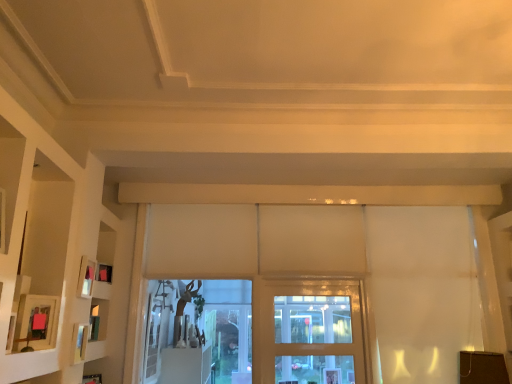
What do you see at coordinates (104, 273) in the screenshot? This screenshot has height=384, width=512. I see `matte black picture frame at left, the 1th picture frame when ordered from back to front` at bounding box center [104, 273].

This screenshot has width=512, height=384. Find the location of `matte pink picture frame at left, acting as the 3th picture frame starting from the back`. matte pink picture frame at left, acting as the 3th picture frame starting from the back is located at coordinates (36, 323).

The width and height of the screenshot is (512, 384). I want to click on clear glass door at center, so click(x=307, y=331).

From a real-world perspective, between clear glass door at center and white matte shelf at left, who is vertically higher?

In real-world perspective, white matte shelf at left is above.

Does clear glass door at center turn towards white matte shelf at left?

No, clear glass door at center is not oriented towards white matte shelf at left.

Which is more to the left, clear glass door at center or white matte shelf at left?

From the viewer's perspective, white matte shelf at left appears more on the left side.

From the image's perspective, which is above, clear glass door at center or white matte shelf at left?

white matte shelf at left appears higher in the image.

Is matte black picture frame at left, arranged as the third picture frame when viewed from the front, smaller than matte pink picture frame at left, the first picture frame positioned from the front?

Yes.

Considering the sizes of objects matte black picture frame at left, the 1th picture frame when ordered from back to front, and matte pink picture frame at left, the first picture frame positioned from the front, in the image provided, who is shorter, matte black picture frame at left, the 1th picture frame when ordered from back to front, or matte pink picture frame at left, the first picture frame positioned from the front,?

matte black picture frame at left, the 1th picture frame when ordered from back to front, is shorter.

In the image, is matte black picture frame at left, the 1th picture frame when ordered from back to front, positioned in front of or behind matte pink picture frame at left, the first picture frame positioned from the front?

Clearly, matte black picture frame at left, the 1th picture frame when ordered from back to front, is behind matte pink picture frame at left, the first picture frame positioned from the front.

Can you confirm if matte black picture frame at left, the 1th picture frame when ordered from back to front, is thinner than matte pink picture frame at left, acting as the 3th picture frame starting from the back?

Yes, matte black picture frame at left, the 1th picture frame when ordered from back to front, is thinner than matte pink picture frame at left, acting as the 3th picture frame starting from the back.

Who is bigger, matte wooden picture frame at left, the second picture frame from the back, or matte pink picture frame at left, the first picture frame positioned from the front?

matte pink picture frame at left, the first picture frame positioned from the front, is bigger.

Based on their positions, is matte wooden picture frame at left, the second picture frame from the back, located to the left or right of matte pink picture frame at left, the first picture frame positioned from the front?

In the image, matte wooden picture frame at left, the second picture frame from the back, appears on the right side of matte pink picture frame at left, the first picture frame positioned from the front.

Could matte pink picture frame at left, the first picture frame positioned from the front, be considered to be inside matte wooden picture frame at left, the second picture frame from the back?

That's incorrect, matte pink picture frame at left, the first picture frame positioned from the front, is not inside matte wooden picture frame at left, the second picture frame from the back.

Considering the relative sizes of white matte shelf at left and matte pink picture frame at left, acting as the 3th picture frame starting from the back, in the image provided, is white matte shelf at left shorter than matte pink picture frame at left, acting as the 3th picture frame starting from the back,?

No.

Is white matte shelf at left positioned with its back to matte pink picture frame at left, acting as the 3th picture frame starting from the back?

Yes, matte pink picture frame at left, acting as the 3th picture frame starting from the back, is at the back of white matte shelf at left.

Which is less distant, (35, 250) or (21, 326)?

Point (35, 250) is farther from the camera than point (21, 326).

Can you see white matte shelf at left touching matte pink picture frame at left, acting as the 3th picture frame starting from the back?

No, white matte shelf at left is not touching matte pink picture frame at left, acting as the 3th picture frame starting from the back.

Looking at the image, does matte pink picture frame at left, acting as the 3th picture frame starting from the back, seem bigger or smaller compared to white matte shelf at left?

matte pink picture frame at left, acting as the 3th picture frame starting from the back, is smaller than white matte shelf at left.

Could you measure the distance between matte pink picture frame at left, acting as the 3th picture frame starting from the back, and white matte shelf at left?

11.97 inches.

Does matte pink picture frame at left, the first picture frame positioned from the front, have a lesser height compared to white matte shelf at left?

Yes, matte pink picture frame at left, the first picture frame positioned from the front, is shorter than white matte shelf at left.

Identify the location of picture frame that is the 1st one when counting backward from the white matte shelf at left. The width and height of the screenshot is (512, 384). (36, 323).

Is matte wooden picture frame at left, the second picture frame from the back, closer to the viewer compared to white matte shelf at left?

No, matte wooden picture frame at left, the second picture frame from the back, is further to the viewer.

How far apart are matte wooden picture frame at left, the 2th picture frame from the front, and white matte shelf at left?

The distance of matte wooden picture frame at left, the 2th picture frame from the front, from white matte shelf at left is 20.56 inches.

From a real-world perspective, is matte wooden picture frame at left, the 2th picture frame from the front, located beneath white matte shelf at left?

Yes, from a real-world perspective, matte wooden picture frame at left, the 2th picture frame from the front, is below white matte shelf at left.

Is white matte shelf at left located within matte wooden picture frame at left, the 2th picture frame from the front?

No.

Can you tell me how much matte black picture frame at left, arranged as the third picture frame when viewed from the front, and matte wooden picture frame at left, the second picture frame from the back, differ in facing direction?

10.9 degrees.

Looking at this image, is matte black picture frame at left, arranged as the third picture frame when viewed from the front, positioned far away from matte wooden picture frame at left, the 2th picture frame from the front?

No.

Considering the sizes of matte black picture frame at left, the 1th picture frame when ordered from back to front, and matte wooden picture frame at left, the second picture frame from the back, in the image, is matte black picture frame at left, the 1th picture frame when ordered from back to front, taller or shorter than matte wooden picture frame at left, the second picture frame from the back,?

In the image, matte black picture frame at left, the 1th picture frame when ordered from back to front, appears to be shorter than matte wooden picture frame at left, the second picture frame from the back.

This screenshot has height=384, width=512. I want to click on shelf on the left of clear glass door at center, so click(x=35, y=226).

From the matte black picture frame at left, arranged as the third picture frame when viewed from the front, count 1st picture frame to the right and point to it. Please provide its 2D coordinates.

[(36, 323)]

Looking at the image, which one is located further to matte black picture frame at left, arranged as the third picture frame when viewed from the front, clear glass door at center or matte wooden picture frame at left, the 2th picture frame from the front?

clear glass door at center.

Which object lies further to the anchor point matte black picture frame at left, the 1th picture frame when ordered from back to front, white matte shelf at left or matte wooden picture frame at left, the second picture frame from the back?

white matte shelf at left.

Estimate the real-world distances between objects in this image. Which object is further from matte pink picture frame at left, acting as the 3th picture frame starting from the back, matte wooden picture frame at left, the 2th picture frame from the front, or clear glass door at center?

clear glass door at center.

Consider the image. Considering their positions, is matte wooden picture frame at left, the second picture frame from the back, positioned further to matte pink picture frame at left, acting as the 3th picture frame starting from the back, than matte black picture frame at left, arranged as the third picture frame when viewed from the front?

The object further to matte pink picture frame at left, acting as the 3th picture frame starting from the back, is matte black picture frame at left, arranged as the third picture frame when viewed from the front.

Looking at the image, which one is located further to matte wooden picture frame at left, the second picture frame from the back, white matte shelf at left or matte black picture frame at left, the 1th picture frame when ordered from back to front?

white matte shelf at left lies further to matte wooden picture frame at left, the second picture frame from the back, than the other object.

When comparing their distances from matte pink picture frame at left, acting as the 3th picture frame starting from the back, does matte black picture frame at left, the 1th picture frame when ordered from back to front, or matte wooden picture frame at left, the 2th picture frame from the front, seem further?

matte black picture frame at left, the 1th picture frame when ordered from back to front, is positioned further to the anchor matte pink picture frame at left, acting as the 3th picture frame starting from the back.

Estimate the real-world distances between objects in this image. Which object is further from matte pink picture frame at left, acting as the 3th picture frame starting from the back, white matte shelf at left or clear glass door at center?

The object further to matte pink picture frame at left, acting as the 3th picture frame starting from the back, is clear glass door at center.

When comparing their distances from white matte shelf at left, does clear glass door at center or matte wooden picture frame at left, the 2th picture frame from the front, seem closer?

Based on the image, matte wooden picture frame at left, the 2th picture frame from the front, appears to be nearer to white matte shelf at left.

In order to click on picture frame between white matte shelf at left and matte wooden picture frame at left, the second picture frame from the back, in the front-back direction in this screenshot , I will do `click(36, 323)`.

Where is `picture frame between matte pink picture frame at left, acting as the 3th picture frame starting from the back, and matte black picture frame at left, the 1th picture frame when ordered from back to front, along the z-axis`? Image resolution: width=512 pixels, height=384 pixels. picture frame between matte pink picture frame at left, acting as the 3th picture frame starting from the back, and matte black picture frame at left, the 1th picture frame when ordered from back to front, along the z-axis is located at coordinates (86, 277).

This screenshot has height=384, width=512. I want to click on picture frame between matte pink picture frame at left, the first picture frame positioned from the front, and clear glass door at center, so click(x=86, y=277).